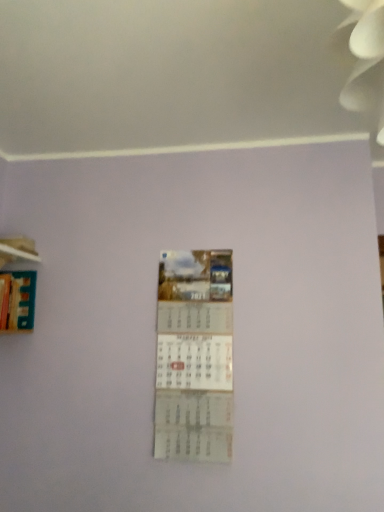
Question: In terms of height, does hardcover book at left look taller or shorter compared to wooden at left?

Choices:
 (A) tall
 (B) short

Answer: (A)

Question: Considering the positions of hardcover book at left and wooden at left in the image, is hardcover book at left wider or thinner than wooden at left?

Choices:
 (A) wide
 (B) thin

Answer: (A)

Question: Which object is the closest to the hardcover book at left?

Choices:
 (A) wooden at left
 (B) white paper calendar at center

Answer: (A)

Question: Considering the real-world distances, which object is closest to the wooden at left?

Choices:
 (A) hardcover book at left
 (B) white paper calendar at center

Answer: (A)